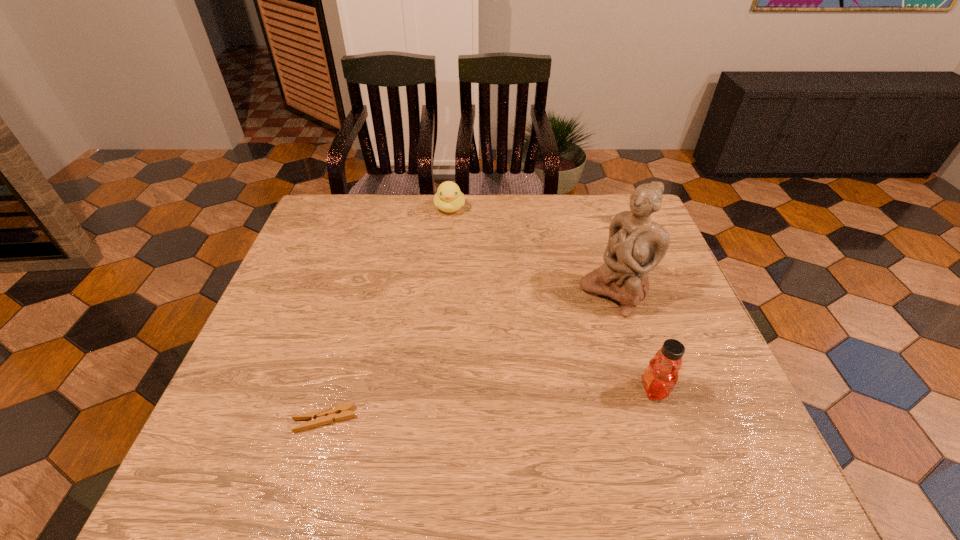
Find the location of a particular element. This screenshot has height=540, width=960. vacant space at the near left corner of the desktop is located at coordinates (226, 414).

This screenshot has width=960, height=540. In order to click on free space between the shortest object and the duckling in this screenshot , I will do `click(387, 314)`.

The width and height of the screenshot is (960, 540). Identify the location of free space between the third shortest object and the second object from left to right. (552, 299).

Find the location of `empty location between the third farthest object and the clothespin`. empty location between the third farthest object and the clothespin is located at coordinates (490, 404).

The width and height of the screenshot is (960, 540). Identify the location of free area in between the leftmost object and the duckling. (387, 314).

Where is `free space that is in between the third farthest object and the duckling`? free space that is in between the third farthest object and the duckling is located at coordinates (552, 299).

This screenshot has height=540, width=960. I want to click on free spot between the honey and the duckling, so click(552, 299).

Where is `vacant area between the figurine and the second tallest object`? The width and height of the screenshot is (960, 540). vacant area between the figurine and the second tallest object is located at coordinates (635, 342).

The height and width of the screenshot is (540, 960). In order to click on vacant area that lies between the farthest object and the tallest object in this screenshot , I will do `click(532, 251)`.

Where is `free point between the honey and the leftmost object`? free point between the honey and the leftmost object is located at coordinates (490, 404).